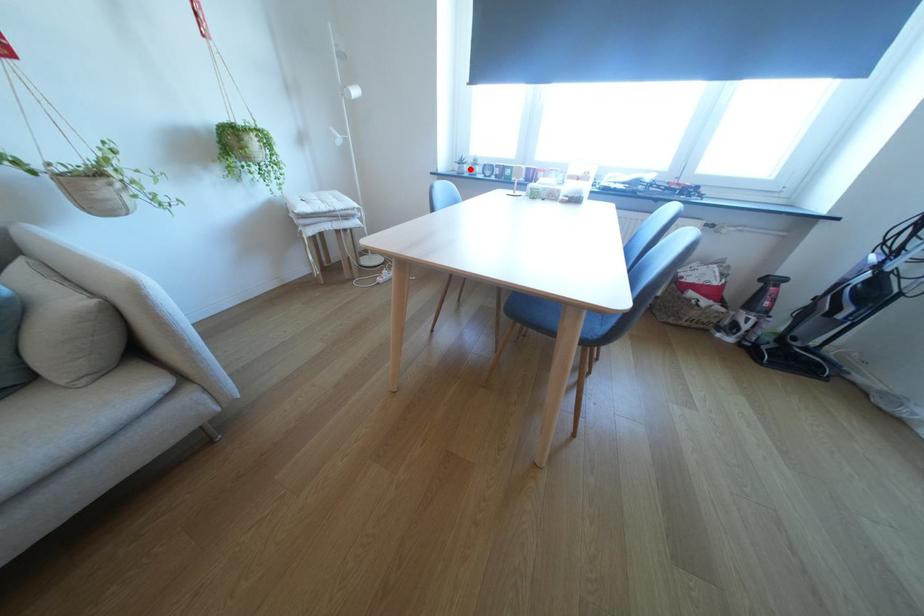
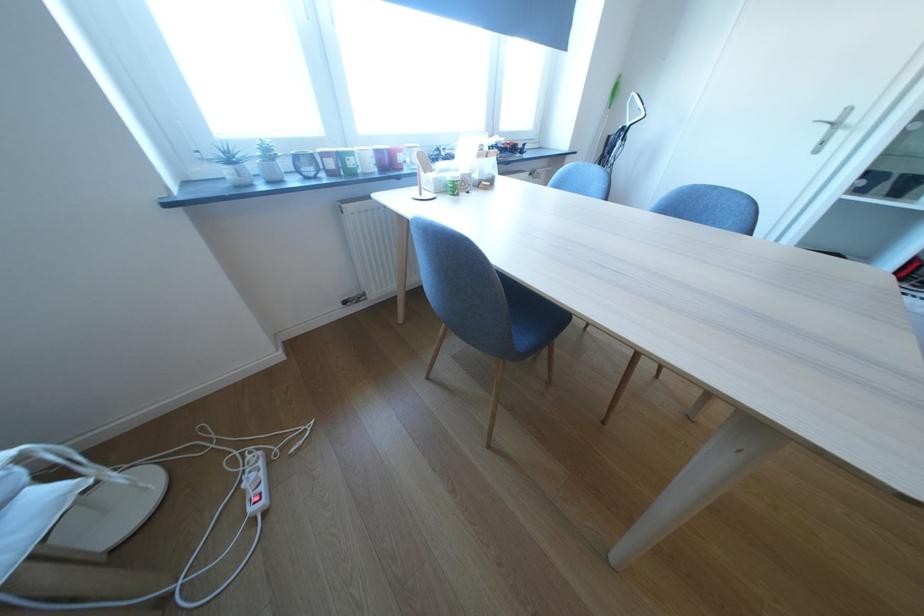
The point at the highlighted location is marked in the first image. Where is the corresponding point in the second image?

(249, 175)